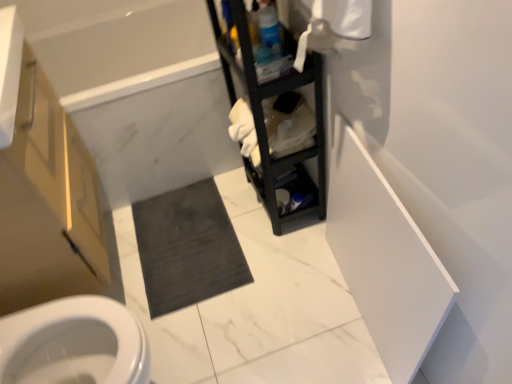
I want to click on white marble bathtub at upper left, so click(x=138, y=89).

You are a GUI agent. You are given a task and a screenshot of the screen. Output one action in this format:
    pyautogui.click(x=<x>, y=<y>)
    Task: Click on the matte wood cabinet at left
    The height and width of the screenshot is (384, 512).
    Given the screenshot: What is the action you would take?
    pyautogui.click(x=48, y=203)

Is white marble bathtub at upper left further to camera compared to black matte shelf at center?

Yes, it is.

Could you tell me if white marble bathtub at upper left is facing black matte shelf at center?

Yes, white marble bathtub at upper left is aimed at black matte shelf at center.

From a real-world perspective, which object stands above the other?

black matte shelf at center is physically above.

Can you tell me how much white marble bathtub at upper left and dark gray carpet at center differ in facing direction?

The angle between the facing direction of white marble bathtub at upper left and the facing direction of dark gray carpet at center is 0.74 degrees.

From the image's perspective, is white marble bathtub at upper left on top of dark gray carpet at center?

Yes, from the image's perspective, white marble bathtub at upper left is over dark gray carpet at center.

Is point (213, 38) less distant than point (213, 224)?

No, (213, 38) is further to viewer.

From a real-world perspective, does white marble bathtub at upper left sit lower than dark gray carpet at center?

No, from a real-world perspective, white marble bathtub at upper left is not below dark gray carpet at center.

Considering the relative positions of dark gray carpet at center and matte wood cabinet at left in the image provided, is dark gray carpet at center behind matte wood cabinet at left?

Yes, the depth of dark gray carpet at center is greater than that of matte wood cabinet at left.

Does dark gray carpet at center touch matte wood cabinet at left?

No, dark gray carpet at center is not in contact with matte wood cabinet at left.

From a real-world perspective, relative to matte wood cabinet at left, is dark gray carpet at center vertically above or below?

Clearly, from a real-world perspective, dark gray carpet at center is below matte wood cabinet at left.

From a real-world perspective, is black matte shelf at center above or below dark gray carpet at center?

From a real-world perspective, black matte shelf at center is physically above dark gray carpet at center.

Is black matte shelf at center far from dark gray carpet at center?

No, black matte shelf at center is not far away from dark gray carpet at center.

Between black matte shelf at center and dark gray carpet at center, which one has smaller size?

dark gray carpet at center is smaller.

From a real-world perspective, is dark gray carpet at center beneath black matte shelf at center?

Yes, from a real-world perspective, dark gray carpet at center is under black matte shelf at center.

Considering the relative positions of dark gray carpet at center and black matte shelf at center in the image provided, is dark gray carpet at center behind black matte shelf at center?

Yes, dark gray carpet at center is further from the camera.

In terms of height, does dark gray carpet at center look taller or shorter compared to black matte shelf at center?

dark gray carpet at center is shorter than black matte shelf at center.

From the image's perspective, which is below, dark gray carpet at center or black matte shelf at center?

From the image's view, dark gray carpet at center is below.

Is dark gray carpet at center at the left side of white marble bathtub at upper left?

No.

Is dark gray carpet at center bigger than white marble bathtub at upper left?

Actually, dark gray carpet at center might be smaller than white marble bathtub at upper left.

From a real-world perspective, is dark gray carpet at center physically above white marble bathtub at upper left?

No, from a real-world perspective, dark gray carpet at center is not over white marble bathtub at upper left

Looking at this image, from a real-world perspective, between black matte shelf at center and matte wood cabinet at left, who is vertically higher?

black matte shelf at center is physically above.

Which object is further away from the camera, black matte shelf at center or matte wood cabinet at left?

black matte shelf at center is further away from the camera.

Considering the relative sizes of black matte shelf at center and matte wood cabinet at left in the image provided, is black matte shelf at center shorter than matte wood cabinet at left?

No, black matte shelf at center is not shorter than matte wood cabinet at left.

Can we say black matte shelf at center lies outside matte wood cabinet at left?

Absolutely, black matte shelf at center is external to matte wood cabinet at left.

The image size is (512, 384). Identify the location of shelf that appears on the right of white marble bathtub at upper left. (264, 122).

Where is `bath mat that appears behind the white marble bathtub at upper left`? bath mat that appears behind the white marble bathtub at upper left is located at coordinates (187, 247).

Looking at the image, which one is located closer to black matte shelf at center, dark gray carpet at center or matte wood cabinet at left?

The object closer to black matte shelf at center is dark gray carpet at center.

From the image, which object appears to be nearer to black matte shelf at center, dark gray carpet at center or white marble bathtub at upper left?

white marble bathtub at upper left lies closer to black matte shelf at center than the other object.

From the image, which object appears to be nearer to matte wood cabinet at left, white marble bathtub at upper left or black matte shelf at center?

Based on the image, white marble bathtub at upper left appears to be nearer to matte wood cabinet at left.

From the image, which object appears to be nearer to white marble bathtub at upper left, dark gray carpet at center or black matte shelf at center?

The object closer to white marble bathtub at upper left is dark gray carpet at center.

Estimate the real-world distances between objects in this image. Which object is further from dark gray carpet at center, white marble bathtub at upper left or black matte shelf at center?

black matte shelf at center is further to dark gray carpet at center.

When comparing their distances from matte wood cabinet at left, does dark gray carpet at center or black matte shelf at center seem closer?

dark gray carpet at center.

From the image, which object appears to be nearer to black matte shelf at center, matte wood cabinet at left or white marble bathtub at upper left?

white marble bathtub at upper left lies closer to black matte shelf at center than the other object.

When comparing their distances from matte wood cabinet at left, does white marble bathtub at upper left or dark gray carpet at center seem closer?

white marble bathtub at upper left lies closer to matte wood cabinet at left than the other object.

At what (x,y) coordinates should I click in order to perform the action: click on bath between matte wood cabinet at left and dark gray carpet at center along the z-axis. Please return your answer as a coordinate pair (x, y). Looking at the image, I should click on (138, 89).

In order to click on shelf between matte wood cabinet at left and dark gray carpet at center in the front-back direction in this screenshot , I will do `click(264, 122)`.

I want to click on bath situated between matte wood cabinet at left and black matte shelf at center from left to right, so click(x=138, y=89).

The width and height of the screenshot is (512, 384). Find the location of `bath located between black matte shelf at center and dark gray carpet at center in the depth direction`. bath located between black matte shelf at center and dark gray carpet at center in the depth direction is located at coordinates tap(138, 89).